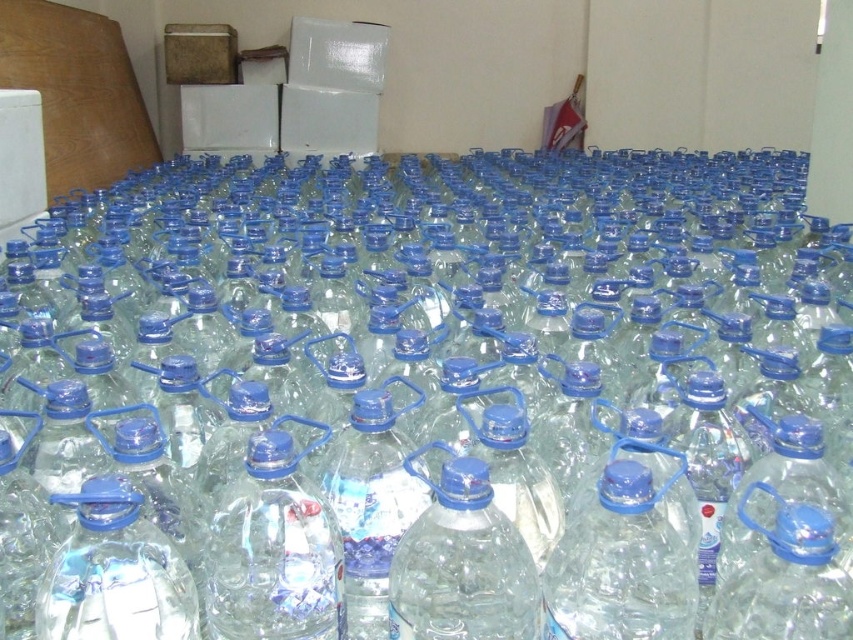
Does clear plastic bottle at center appear over transparent plastic bottle at center?

Incorrect, clear plastic bottle at center is not positioned above transparent plastic bottle at center.

The width and height of the screenshot is (853, 640). Describe the element at coordinates (273, 550) in the screenshot. I see `clear plastic bottle at center` at that location.

Locate an element on the screen. The height and width of the screenshot is (640, 853). clear plastic bottle at center is located at coordinates (273, 550).

At what (x,y) coordinates should I click in order to perform the action: click on clear plastic bottle at center. Please return your answer as a coordinate pair (x, y). Looking at the image, I should click on coord(273,550).